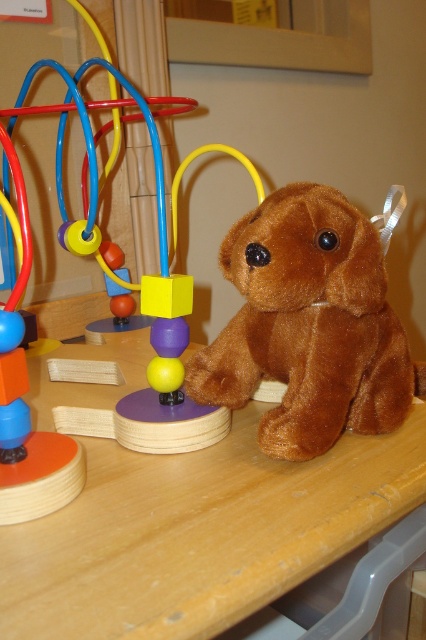
Is wooden table at center to the right of brown plush bear at right from the viewer's perspective?

Yes, wooden table at center is to the right of brown plush bear at right.

Between point (152, 579) and point (256, 189), which one is positioned behind?

The point (256, 189) is more distant.

Is point (100, 486) more distant than point (172, 330)?

No.

Where is `wooden table at center`? The width and height of the screenshot is (426, 640). wooden table at center is located at coordinates (199, 532).

Who is lower down, brown plush toy at center or brown plush bear at right?

brown plush toy at center is lower down.

What are the coordinates of `brown plush toy at center` in the screenshot? It's located at (308, 324).

The height and width of the screenshot is (640, 426). I want to click on brown plush toy at center, so click(308, 324).

From the picture: Between wooden table at center and brown plush toy at center, which one appears on the right side from the viewer's perspective?

From the viewer's perspective, brown plush toy at center appears more on the right side.

Consider the image. How far apart are wooden table at center and brown plush toy at center?

A distance of 4.34 inches exists between wooden table at center and brown plush toy at center.

Measure the distance between point (244, 557) and camera.

A distance of 14.82 inches exists between point (244, 557) and camera.

Locate an element on the screen. wooden table at center is located at coordinates (199, 532).